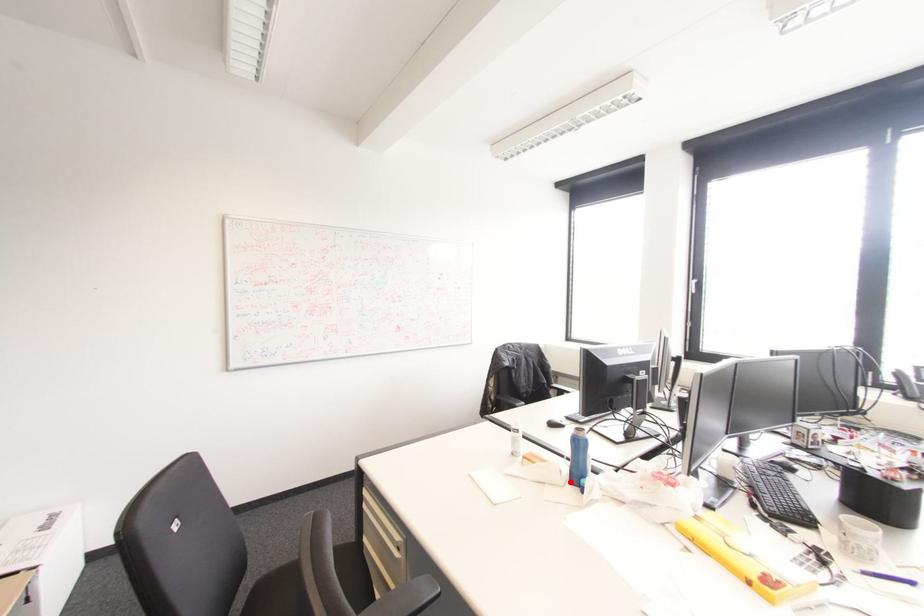
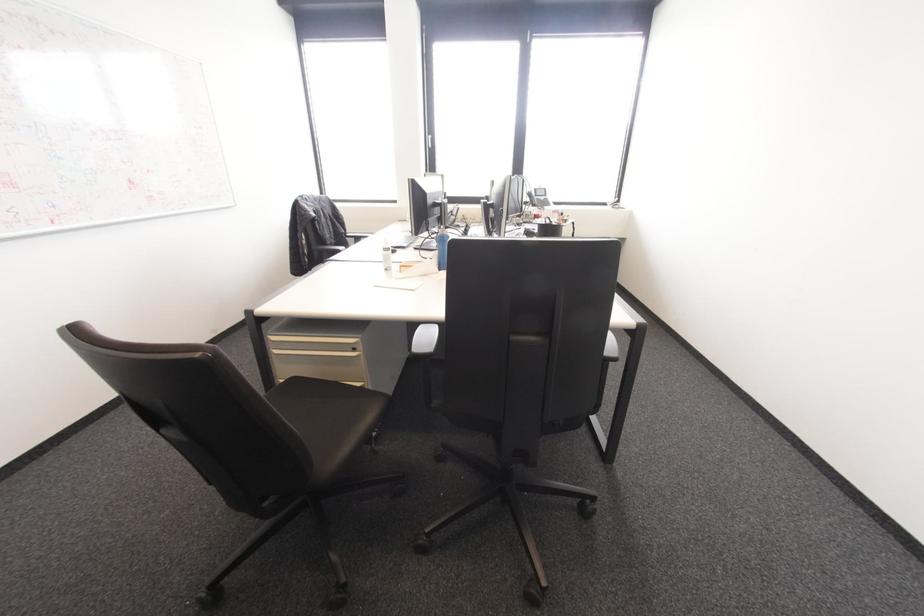
Question: I am providing you with two images of the same scene from different viewpoints. Given a red point in image1, look at the same physical point in image2. Is it:

Choices:
 (A) Closer to the viewpoint
 (B) Farther from the viewpoint

Answer: (A)